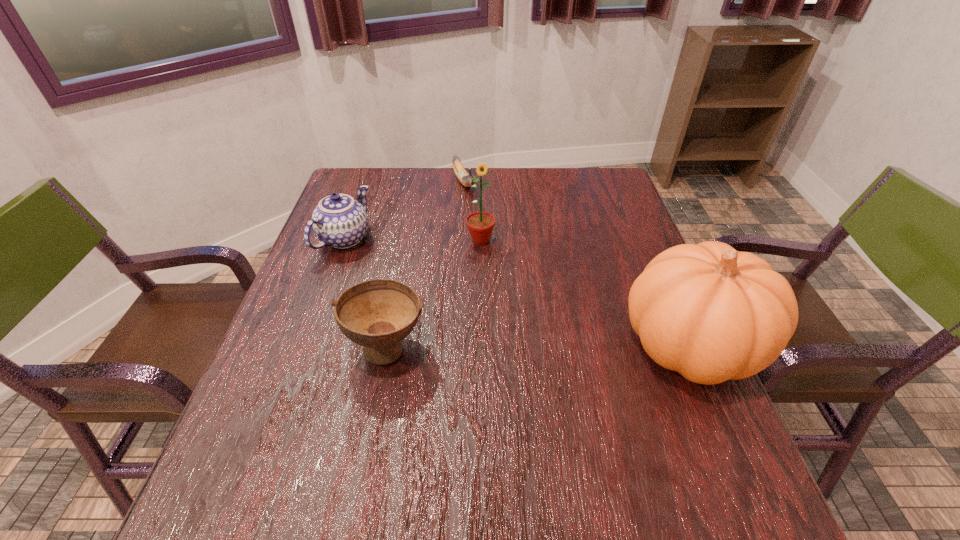
Find the location of `unoccupied position between the pumpkin and the second object from left to right`. unoccupied position between the pumpkin and the second object from left to right is located at coordinates (540, 346).

Find the location of a particular element. free area in between the soup bowl and the rightmost object is located at coordinates click(540, 346).

Identify the location of free space between the sunflower and the second object from left to right. This screenshot has width=960, height=540. pyautogui.click(x=434, y=293).

Locate an element on the screen. This screenshot has width=960, height=540. free space between the sunflower and the shortest object is located at coordinates (472, 211).

You are a GUI agent. You are given a task and a screenshot of the screen. Output one action in this format:
    pyautogui.click(x=<x>, y=<y>)
    Task: Click on the free spot between the banana and the leftmost object
    Image resolution: width=960 pixels, height=540 pixels.
    Given the screenshot: What is the action you would take?
    pyautogui.click(x=404, y=211)

Image resolution: width=960 pixels, height=540 pixels. I want to click on vacant region between the shortest object and the sunflower, so click(x=472, y=211).

You are a GUI agent. You are given a task and a screenshot of the screen. Output one action in this format:
    pyautogui.click(x=<x>, y=<y>)
    Task: Click on the vacant point located between the chinaware and the farthest object
    This screenshot has width=960, height=540.
    Given the screenshot: What is the action you would take?
    pyautogui.click(x=404, y=211)

What are the coordinates of `object identified as the fourth closest to the shortest object` in the screenshot? It's located at point(711,313).

Find the location of a particular element. the second closest object to the farthest object is located at coordinates (339, 221).

What are the coordinates of `free point that satisfies the following two spatial constraints: 1. on the back side of the sunflower; 2. on the right side of the soup bowl` in the screenshot? It's located at (408, 240).